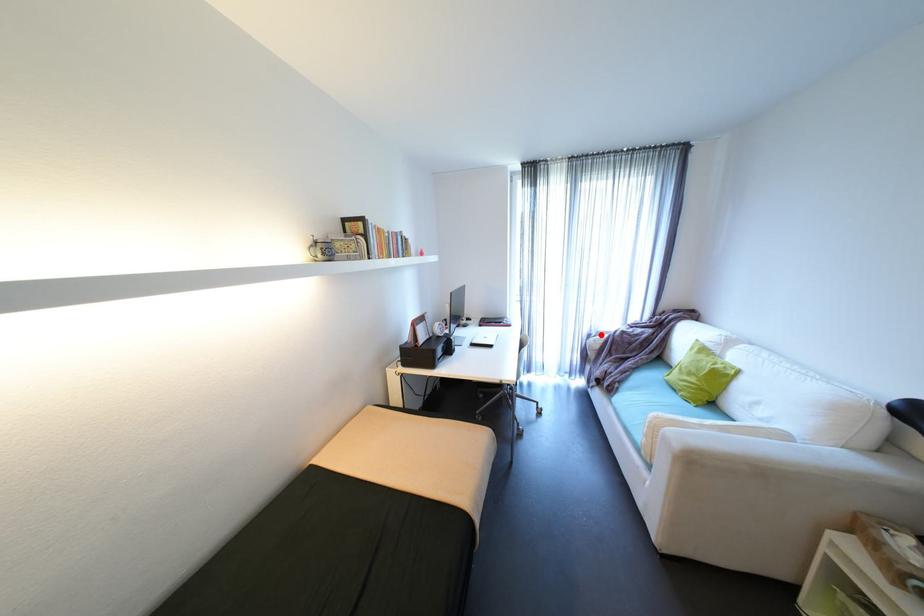
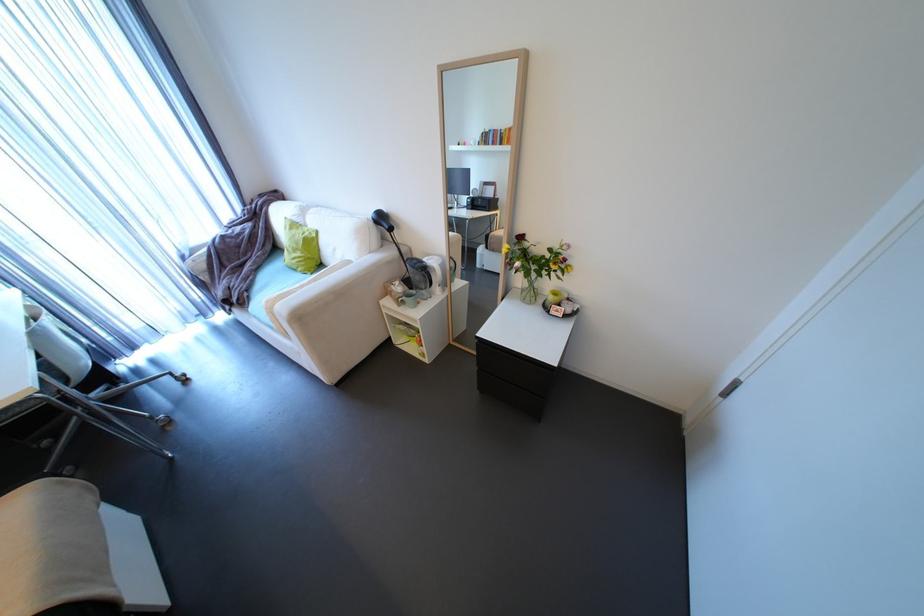
Locate, in the second image, the point that corresponds to the highlighted location in the first image.

(195, 254)